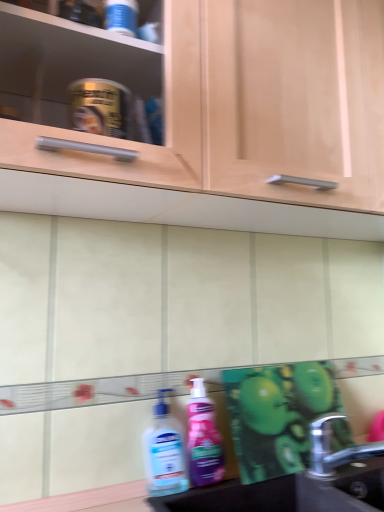
Question: Does pink glossy lotion at lower center, which is counted as the second cleaning product, starting from the left, have a lesser width compared to silver metallic faucet at lower right?

Choices:
 (A) no
 (B) yes

Answer: (B)

Question: From a real-world perspective, is pink glossy lotion at lower center, marked as the first cleaning product in a right-to-left arrangement, positioned over silver metallic faucet at lower right based on gravity?

Choices:
 (A) no
 (B) yes

Answer: (B)

Question: Does pink glossy lotion at lower center, which is counted as the second cleaning product, starting from the left, appear on the left side of silver metallic faucet at lower right?

Choices:
 (A) no
 (B) yes

Answer: (B)

Question: Is pink glossy lotion at lower center, marked as the first cleaning product in a right-to-left arrangement, smaller than silver metallic faucet at lower right?

Choices:
 (A) no
 (B) yes

Answer: (B)

Question: Can you confirm if pink glossy lotion at lower center, marked as the first cleaning product in a right-to-left arrangement, is taller than silver metallic faucet at lower right?

Choices:
 (A) yes
 (B) no

Answer: (A)

Question: Considering the relative positions of matte wood cabinet at upper center and pink glossy lotion at lower center, marked as the first cleaning product in a right-to-left arrangement, in the image provided, is matte wood cabinet at upper center to the left of pink glossy lotion at lower center, marked as the first cleaning product in a right-to-left arrangement, from the viewer's perspective?

Choices:
 (A) yes
 (B) no

Answer: (B)

Question: Is matte wood cabinet at upper center facing away from pink glossy lotion at lower center, which is counted as the second cleaning product, starting from the left?

Choices:
 (A) yes
 (B) no

Answer: (B)

Question: Is matte wood cabinet at upper center not inside pink glossy lotion at lower center, which is counted as the second cleaning product, starting from the left?

Choices:
 (A) no
 (B) yes

Answer: (B)

Question: Is pink glossy lotion at lower center, marked as the first cleaning product in a right-to-left arrangement, completely or partially inside matte wood cabinet at upper center?

Choices:
 (A) no
 (B) yes

Answer: (A)

Question: Can you see matte wood cabinet at upper center touching pink glossy lotion at lower center, marked as the first cleaning product in a right-to-left arrangement?

Choices:
 (A) yes
 (B) no

Answer: (B)

Question: Does matte wood cabinet at upper center appear on the right side of pink glossy lotion at lower center, marked as the first cleaning product in a right-to-left arrangement?

Choices:
 (A) no
 (B) yes

Answer: (B)

Question: Is black matte sink at lower right positioned behind matte wood cabinet at upper center?

Choices:
 (A) no
 (B) yes

Answer: (B)